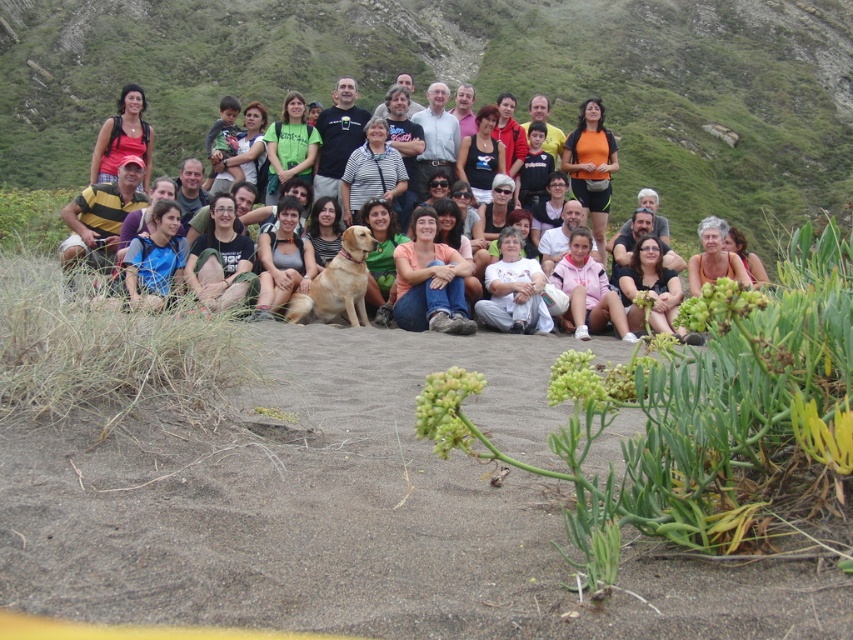
Looking at this image, you are a photographer trying to capture a clear shot of the matte black shirt at center and the matte black backpack at center. Since both are matte black, you want to adjust your camera settings to ensure they are distinguishable in the photo. What visual cue can you use to differentiate them based on their sizes?

The matte black shirt at center has a larger size compared to the matte black backpack at center, so you can adjust the camera focus to highlight the size difference between the two objects.